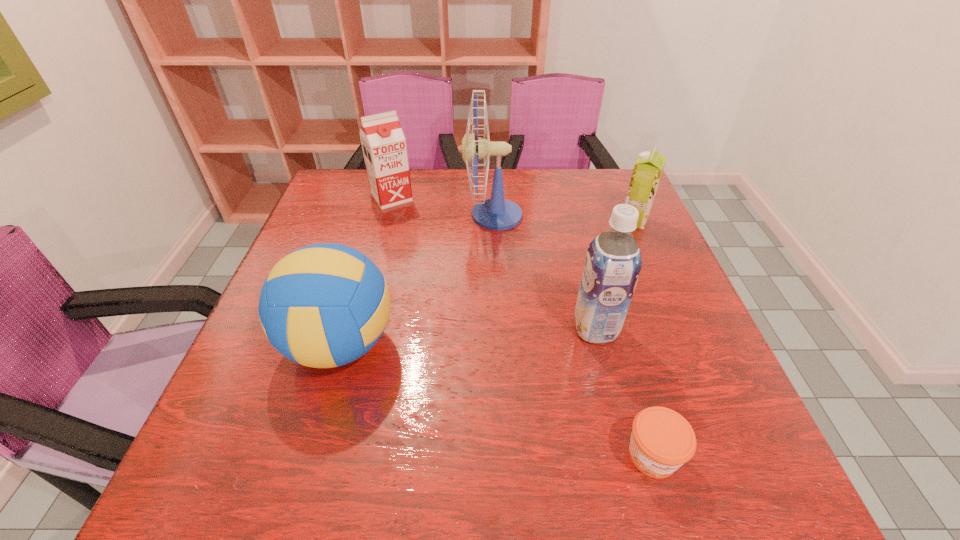
The width and height of the screenshot is (960, 540). I want to click on vacant area at the left edge, so click(x=359, y=242).

The height and width of the screenshot is (540, 960). I want to click on free region at the near left corner of the desktop, so click(x=226, y=495).

This screenshot has height=540, width=960. In order to click on vacant space at the far right corner of the desktop in this screenshot , I will do `click(584, 192)`.

This screenshot has width=960, height=540. I want to click on free space between the fourth object from right to left and the volleyball, so click(x=417, y=280).

You are a GUI agent. You are given a task and a screenshot of the screen. Output one action in this format:
    pyautogui.click(x=<x>, y=<y>)
    Task: Click on the free space between the tallest soya milk and the jam
    
    Given the screenshot: What is the action you would take?
    pyautogui.click(x=624, y=392)

You are a GUI agent. You are given a task and a screenshot of the screen. Output one action in this format:
    pyautogui.click(x=<x>, y=<y>)
    Task: Click on the free space between the second soya milk from left to right and the fan
    
    Given the screenshot: What is the action you would take?
    pyautogui.click(x=544, y=272)

Locate an element on the screen. This screenshot has height=540, width=960. free spot between the jam and the second soya milk from right to left is located at coordinates (624, 392).

You are a GUI agent. You are given a task and a screenshot of the screen. Output one action in this format:
    pyautogui.click(x=<x>, y=<y>)
    Task: Click on the free spot between the second farthest soya milk and the shortest object
    Image resolution: width=960 pixels, height=540 pixels.
    Given the screenshot: What is the action you would take?
    pyautogui.click(x=643, y=338)

I want to click on empty space between the nearest soya milk and the leftmost soya milk, so click(493, 263).

Locate an element on the screen. Image resolution: width=960 pixels, height=540 pixels. empty space that is in between the fourth object from right to left and the rightmost soya milk is located at coordinates (564, 218).